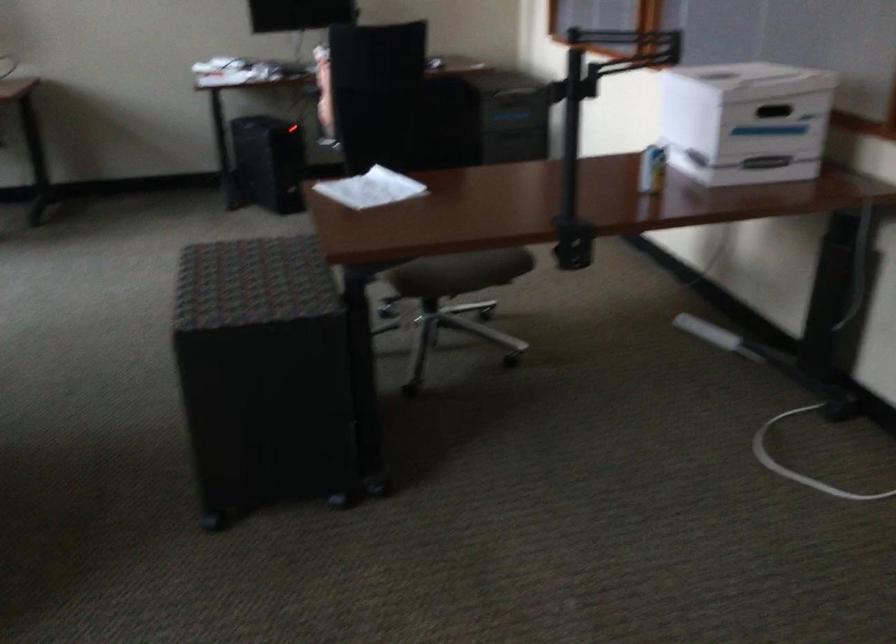
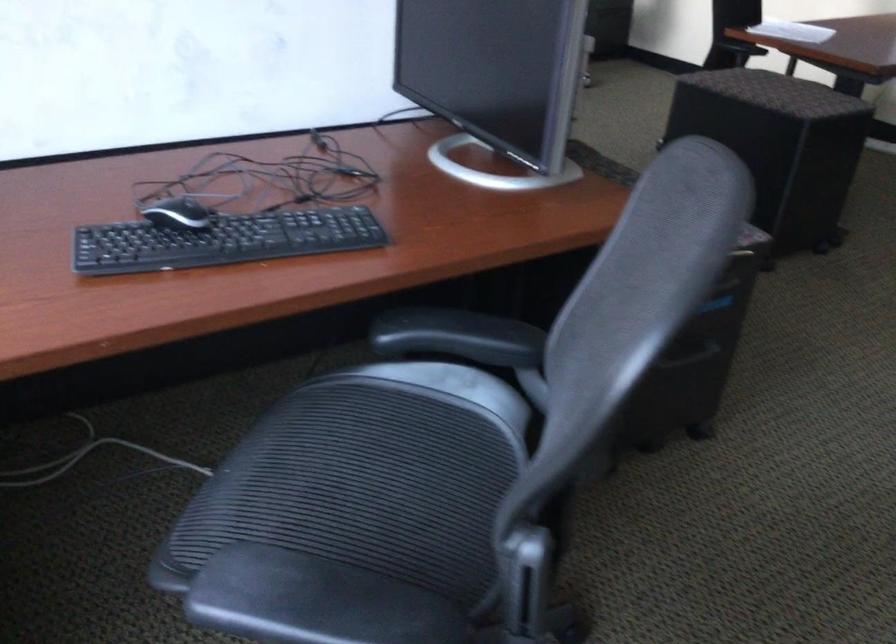
Question: The images are taken continuously from a first-person perspective. In which direction are you moving?

Choices:
 (A) Left
 (B) Right
 (C) Forward
 (D) Backward

Answer: (A)